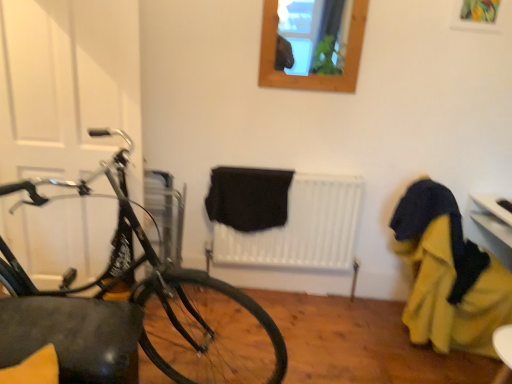
The height and width of the screenshot is (384, 512). Identify the location of wooden frame at upper center. (312, 75).

What is the approximate height of yellow fabric at right?

yellow fabric at right is 36.18 inches in height.

Image resolution: width=512 pixels, height=384 pixels. I want to click on white matte door at left, so click(68, 87).

Locate an element on the screen. The height and width of the screenshot is (384, 512). wooden frame at upper center is located at coordinates (312, 75).

Between point (319, 236) and point (424, 234), which one is positioned in front?

The point (424, 234) is closer to the camera.

Is black matte radiator at center positioned with its back to yellow fabric at right?

No, black matte radiator at center is not facing the opposite direction of yellow fabric at right.

From the image's perspective, is black matte radiator at center positioned above or below yellow fabric at right?

From the image's perspective, black matte radiator at center appears above yellow fabric at right.

Based on the photo, can you confirm if black matte radiator at center is wider than yellow fabric at right?

In fact, black matte radiator at center might be narrower than yellow fabric at right.

Is white matte door at left facing towards wooden frame at upper center?

No, white matte door at left is not turned towards wooden frame at upper center.

Are white matte door at left and wooden frame at upper center located far from each other?

Absolutely, white matte door at left is distant from wooden frame at upper center.

At what (x,y) coordinates should I click in order to perform the action: click on window behind the white matte door at left. Please return your answer as a coordinate pair (x, y). Image resolution: width=512 pixels, height=384 pixels. Looking at the image, I should click on (312, 75).

From a real-world perspective, which is physically below, yellow fabric at right or white matte door at left?

yellow fabric at right, from a real-world perspective.

Would you say yellow fabric at right contains white matte door at left?

No, white matte door at left is not a part of yellow fabric at right.

Considering the positions of point (420, 257) and point (65, 169), is point (420, 257) closer or farther from the camera than point (65, 169)?

Point (420, 257).

Does yellow fabric at right turn towards white matte door at left?

No, yellow fabric at right is not facing towards white matte door at left.

Which object is more forward, black matte radiator at center or white matte door at left?

white matte door at left is closer to the camera.

Based on the photo, would you say black matte radiator at center is outside white matte door at left?

Yes, black matte radiator at center is outside of white matte door at left.

From the image's perspective, is black matte radiator at center located above white matte door at left?

No, from the image's perspective, black matte radiator at center is not over white matte door at left.

Consider the image. Is black matte radiator at center facing towards white matte door at left?

No, black matte radiator at center does not turn towards white matte door at left.

From the image's perspective, which is below, shiny black bicycle at left or black matte radiator at center?

shiny black bicycle at left is shown below in the image.

How many degrees apart are the facing directions of shiny black bicycle at left and black matte radiator at center?

The facing directions of shiny black bicycle at left and black matte radiator at center are 83.7 degrees apart.

Considering the points (99, 312) and (349, 177), which point is behind, point (99, 312) or point (349, 177)?

The point (349, 177) is farther.

What are the coordinates of `bicycle that appears above the black matte radiator at center (from a real-world perspective)` in the screenshot? It's located at (129, 307).

Is yellow fabric at right wider or thinner than black matte radiator at center?

In the image, yellow fabric at right appears to be wider than black matte radiator at center.

How far apart are yellow fabric at right and black matte radiator at center?

yellow fabric at right is 23.34 inches from black matte radiator at center.

Is yellow fabric at right aimed at black matte radiator at center?

No, yellow fabric at right is not aimed at black matte radiator at center.

Where is `laundry below the black matte radiator at center (from the image's perspective)`? laundry below the black matte radiator at center (from the image's perspective) is located at coordinates (448, 275).

Which is farther from the camera, (344, 64) or (480, 276)?

The point (344, 64) is farther from the camera.

From their relative heights in the image, would you say wooden frame at upper center is taller or shorter than yellow fabric at right?

Clearly, wooden frame at upper center is shorter compared to yellow fabric at right.

In the scene shown: Does wooden frame at upper center lie behind yellow fabric at right?

Yes, wooden frame at upper center is further from the camera.

Is wooden frame at upper center looking in the opposite direction of yellow fabric at right?

wooden frame at upper center does not have its back to yellow fabric at right.

The image size is (512, 384). I want to click on radiator behind the yellow fabric at right, so click(x=301, y=228).

The width and height of the screenshot is (512, 384). Identify the location of door in front of the wooden frame at upper center. (68, 87).

When comparing their distances from black matte radiator at center, does white matte door at left or wooden frame at upper center seem closer?

The object closer to black matte radiator at center is wooden frame at upper center.

Looking at the image, which one is located closer to black matte radiator at center, shiny black bicycle at left or wooden frame at upper center?

shiny black bicycle at left lies closer to black matte radiator at center than the other object.

Based on the photo, looking at the image, which one is located closer to shiny black bicycle at left, black matte radiator at center or yellow fabric at right?

black matte radiator at center.

Considering their positions, is wooden frame at upper center positioned closer to black matte radiator at center than white matte door at left?

Based on the image, wooden frame at upper center appears to be nearer to black matte radiator at center.

Based on their spatial positions, is yellow fabric at right or black matte radiator at center closer to shiny black bicycle at left?

black matte radiator at center is positioned closer to the anchor shiny black bicycle at left.

Looking at the image, which one is located further to shiny black bicycle at left, white matte door at left or yellow fabric at right?

The object further to shiny black bicycle at left is yellow fabric at right.

Looking at the image, which one is located further to yellow fabric at right, black matte radiator at center or white matte door at left?

Based on the image, white matte door at left appears to be further to yellow fabric at right.

Looking at the image, which one is located closer to wooden frame at upper center, black matte radiator at center or yellow fabric at right?

Based on the image, black matte radiator at center appears to be nearer to wooden frame at upper center.

You are a GUI agent. You are given a task and a screenshot of the screen. Output one action in this format:
    pyautogui.click(x=<x>, y=<y>)
    Task: Click on the bicycle located between white matte door at left and wooden frame at upper center in the left-right direction
    The width and height of the screenshot is (512, 384).
    Given the screenshot: What is the action you would take?
    coord(129,307)

I want to click on door between shiny black bicycle at left and black matte radiator at center along the z-axis, so click(x=68, y=87).

Identify the location of window between shiny black bicycle at left and black matte radiator at center in the front-back direction. Image resolution: width=512 pixels, height=384 pixels. (312, 75).

This screenshot has height=384, width=512. I want to click on radiator between white matte door at left and wooden frame at upper center, so click(x=301, y=228).